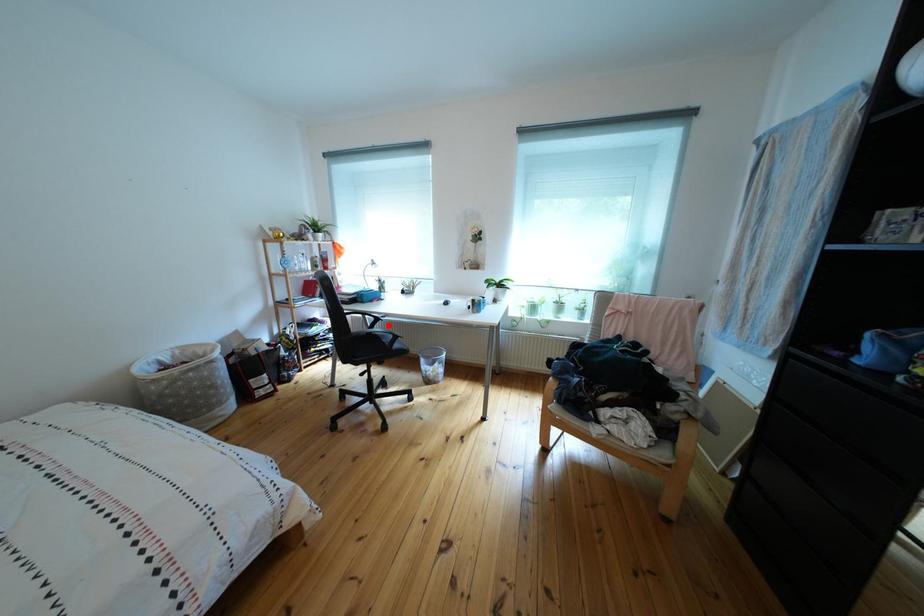
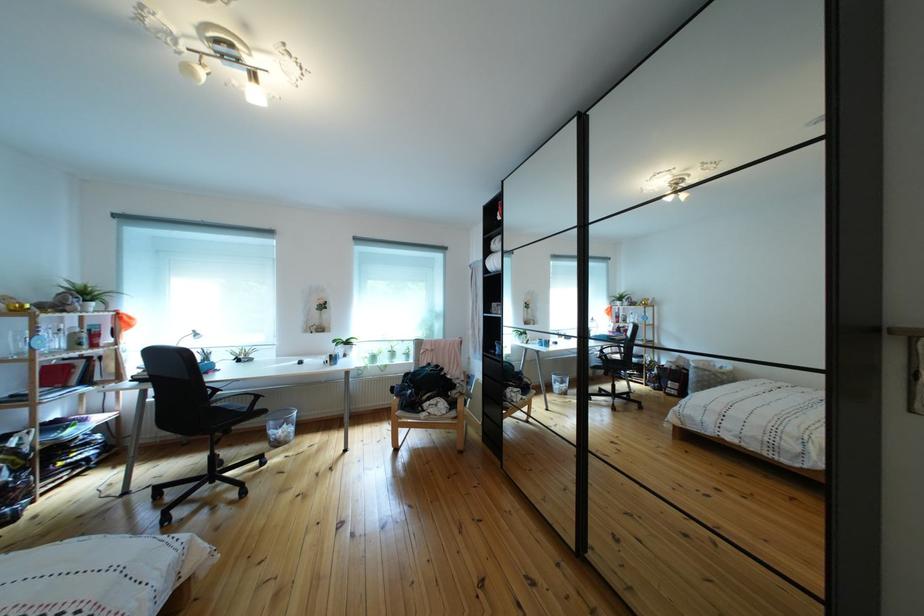
The point at the highlighted location is marked in the first image. Where is the corresponding point in the second image?

(227, 395)